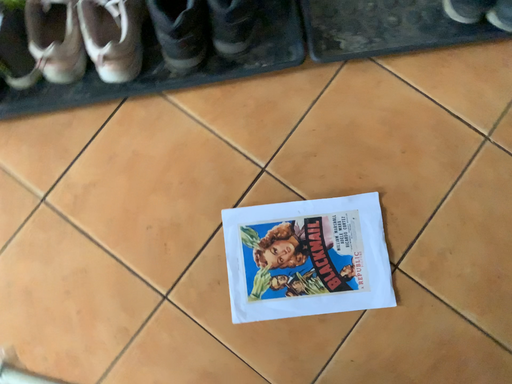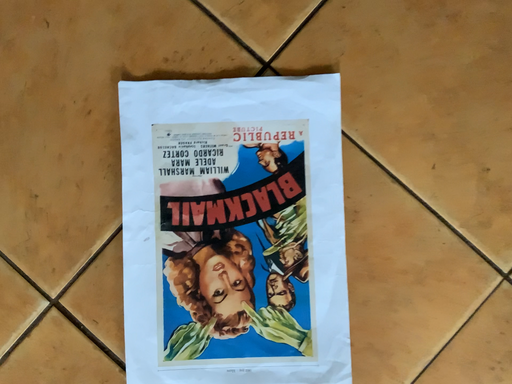
Question: How did the camera likely rotate when shooting the video?

Choices:
 (A) rotated right
 (B) rotated left

Answer: (A)